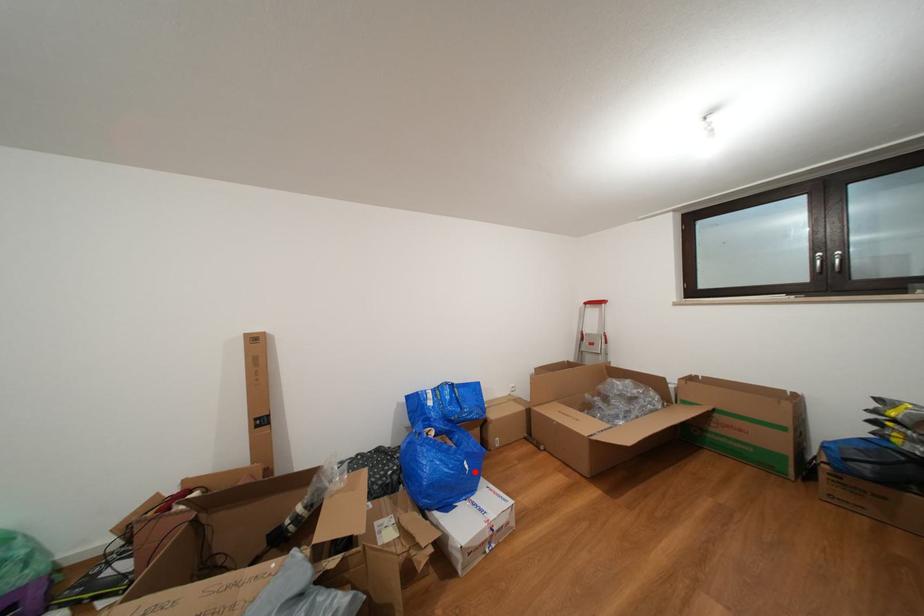
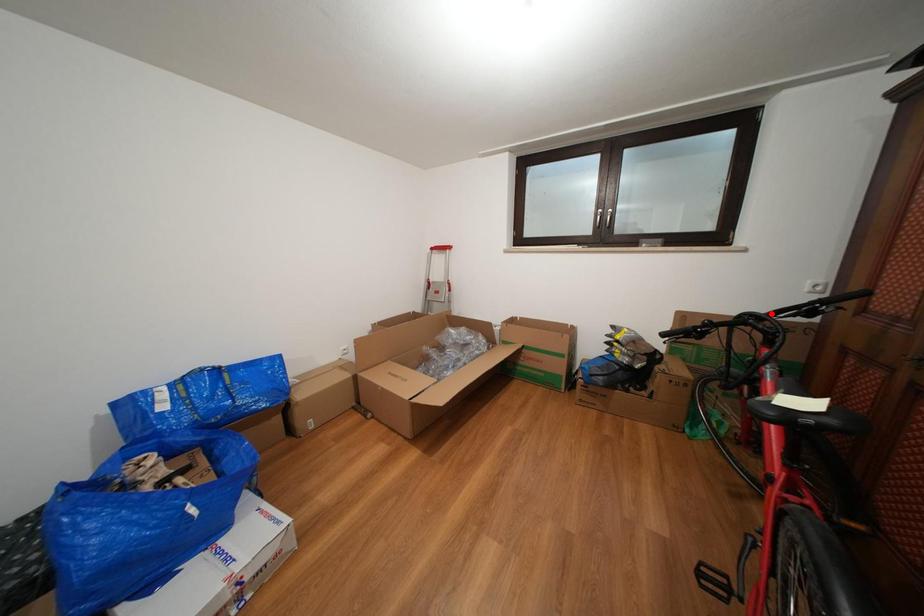
I am providing you with two images of the same scene from different viewpoints. A red point is marked on the first image and another point is marked on the second image. Does the point marked in image1 correspond to the same location as the one in image2?

No